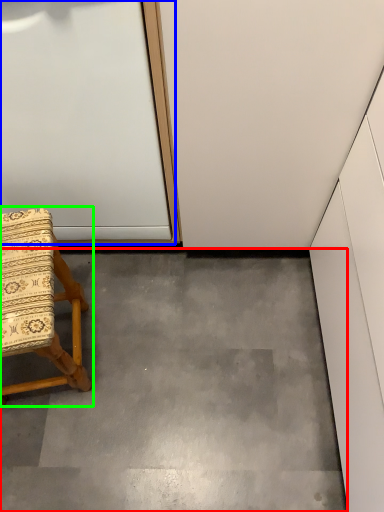
Question: Which object is positioned closest to concrete (highlighted by a red box)? Select from door (highlighted by a blue box) and chair (highlighted by a green box).

Choices:
 (A) door
 (B) chair

Answer: (B)